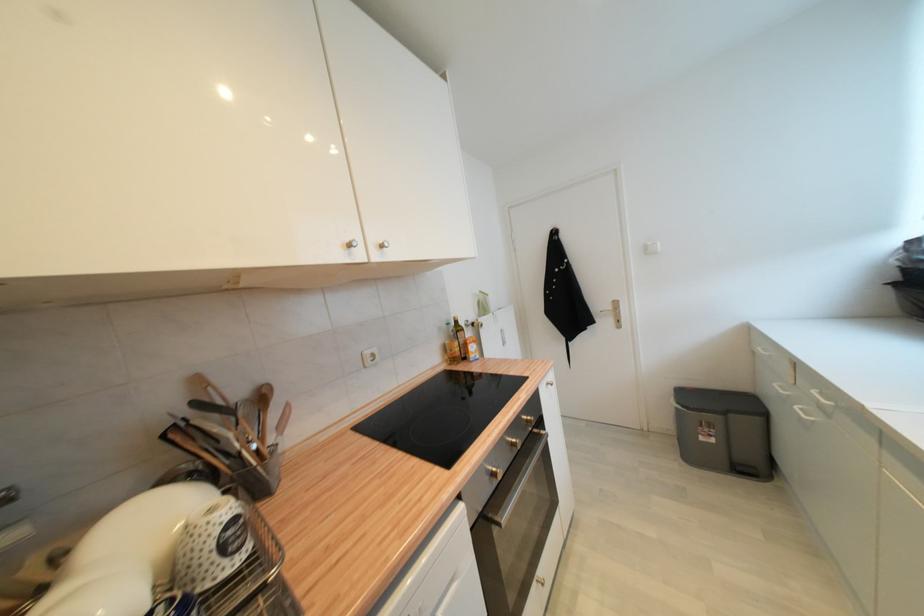
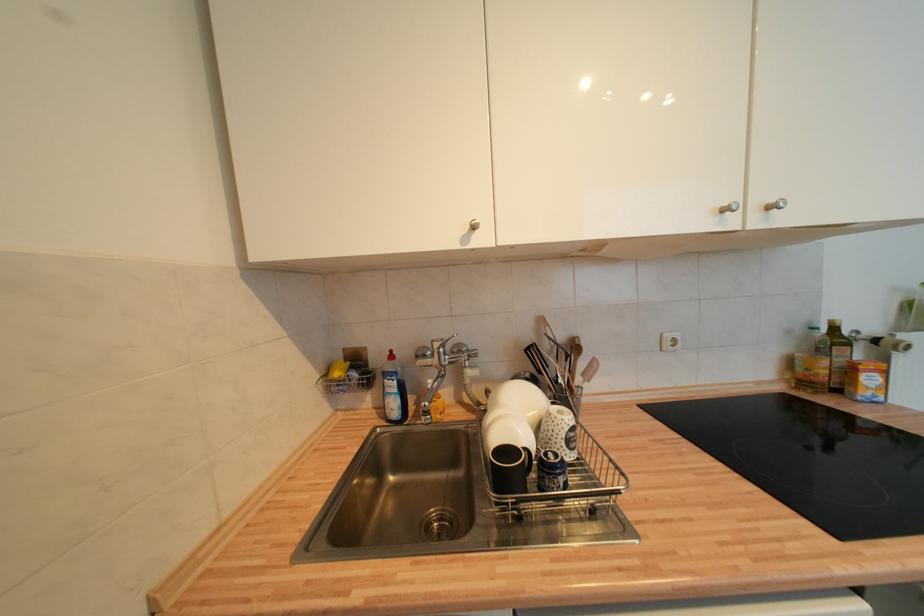
In the second image, find the point that corresponds to (x=283, y=430) in the first image.

(588, 377)